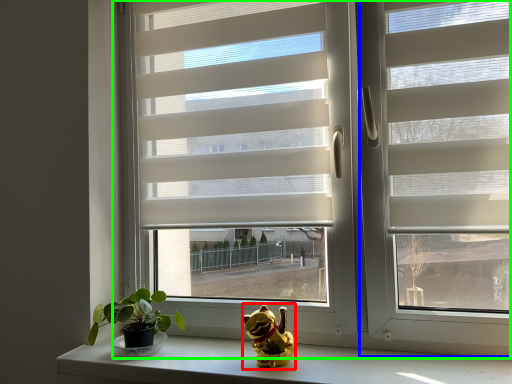
Question: Which object is the farthest from figurine (highlighted by a red box)? Choose among these: screen door (highlighted by a blue box) or window (highlighted by a green box).

Choices:
 (A) screen door
 (B) window

Answer: (B)